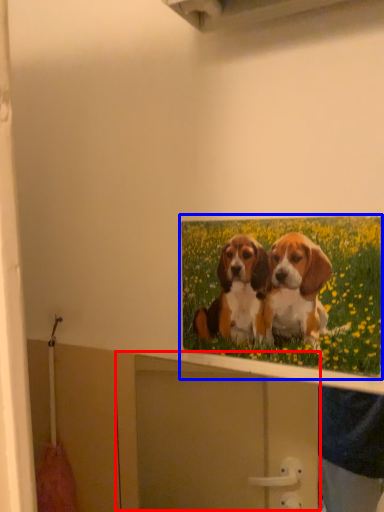
Question: Which of the following is the farthest to the observer, cabinet (highlighted by a red box) or picture frame (highlighted by a blue box)?

Choices:
 (A) cabinet
 (B) picture frame

Answer: (B)